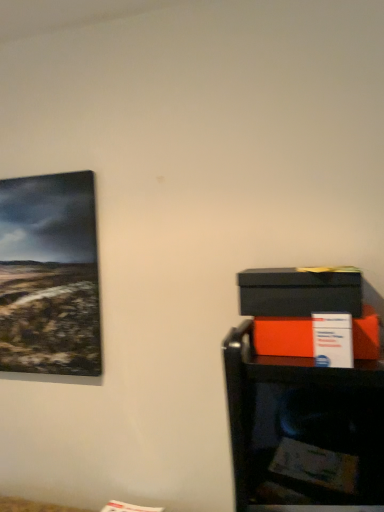
Question: Is matte orange box at right, arranged as the 2th box when viewed from the top, to the left of matte black box at right, marked as the first box in a top-to-bottom arrangement, from the viewer's perspective?

Choices:
 (A) yes
 (B) no

Answer: (B)

Question: Is matte orange box at right, which is the first box in bottom-to-top order, shorter than matte black box at right, which is the 2th box from bottom to top?

Choices:
 (A) yes
 (B) no

Answer: (A)

Question: Considering the relative positions of matte orange box at right, arranged as the 2th box when viewed from the top, and matte black box at right, marked as the first box in a top-to-bottom arrangement, in the image provided, is matte orange box at right, arranged as the 2th box when viewed from the top, to the right of matte black box at right, marked as the first box in a top-to-bottom arrangement, from the viewer's perspective?

Choices:
 (A) yes
 (B) no

Answer: (A)

Question: Is matte orange box at right, which is the first box in bottom-to-top order, not inside matte black box at right, marked as the first box in a top-to-bottom arrangement?

Choices:
 (A) yes
 (B) no

Answer: (A)

Question: Does matte orange box at right, arranged as the 2th box when viewed from the top, have a smaller size compared to matte black box at right, which is the 2th box from bottom to top?

Choices:
 (A) no
 (B) yes

Answer: (B)

Question: Considering the relative sizes of matte orange box at right, arranged as the 2th box when viewed from the top, and matte black box at right, which is the 2th box from bottom to top, in the image provided, is matte orange box at right, arranged as the 2th box when viewed from the top, thinner than matte black box at right, which is the 2th box from bottom to top,?

Choices:
 (A) yes
 (B) no

Answer: (A)

Question: Is matte black box at right, which is the 2th box from bottom to top, positioned beyond the bounds of matte orange box at right, arranged as the 2th box when viewed from the top?

Choices:
 (A) yes
 (B) no

Answer: (A)

Question: Considering the relative positions of matte black box at right, marked as the first box in a top-to-bottom arrangement, and matte orange box at right, arranged as the 2th box when viewed from the top, in the image provided, is matte black box at right, marked as the first box in a top-to-bottom arrangement, in front of matte orange box at right, arranged as the 2th box when viewed from the top,?

Choices:
 (A) yes
 (B) no

Answer: (A)

Question: Could matte orange box at right, arranged as the 2th box when viewed from the top, be considered to be inside matte black box at right, marked as the first box in a top-to-bottom arrangement?

Choices:
 (A) yes
 (B) no

Answer: (B)

Question: Is matte black box at right, which is the 2th box from bottom to top, shorter than matte orange box at right, arranged as the 2th box when viewed from the top?

Choices:
 (A) yes
 (B) no

Answer: (B)

Question: Considering the relative sizes of matte black box at right, marked as the first box in a top-to-bottom arrangement, and matte orange box at right, which is the first box in bottom-to-top order, in the image provided, is matte black box at right, marked as the first box in a top-to-bottom arrangement, bigger than matte orange box at right, which is the first box in bottom-to-top order,?

Choices:
 (A) no
 (B) yes

Answer: (B)

Question: Does matte black box at right, which is the 2th box from bottom to top, appear on the right side of matte orange box at right, which is the first box in bottom-to-top order?

Choices:
 (A) no
 (B) yes

Answer: (A)

Question: Is matte orange box at right, which is the first box in bottom-to-top order, looking in the opposite direction of matte black cabinet at lower right?

Choices:
 (A) yes
 (B) no

Answer: (B)